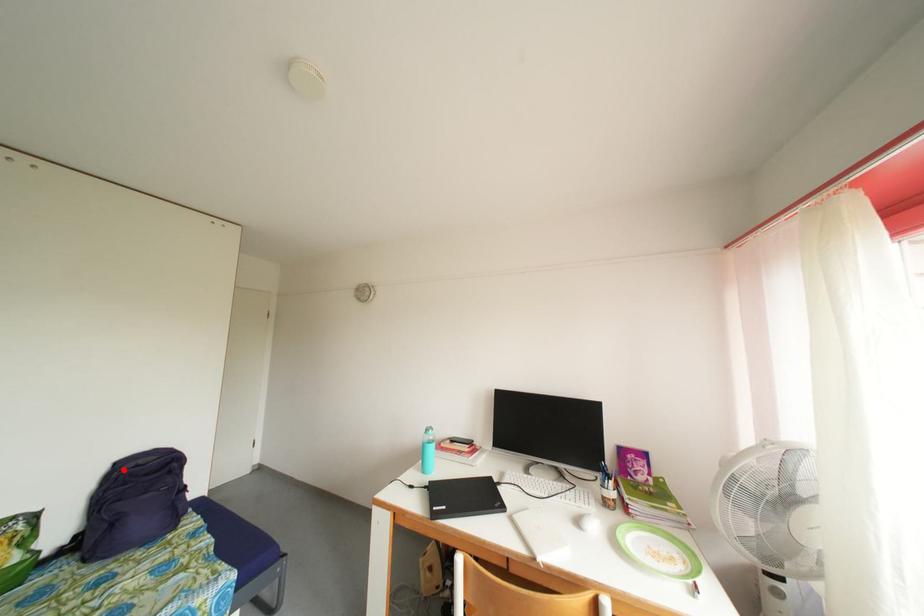
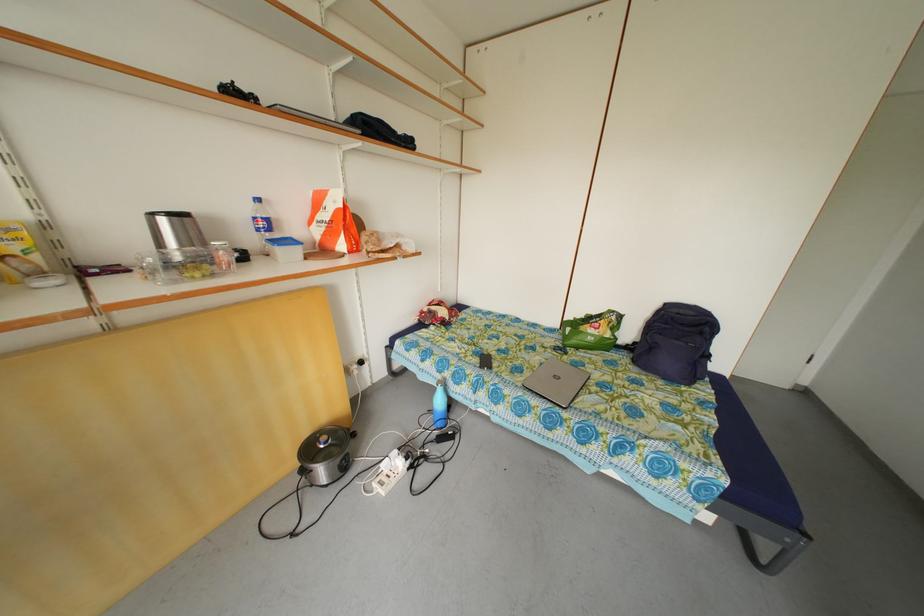
Find the pixel in the second image that matches the highlighted location in the first image.

(673, 310)